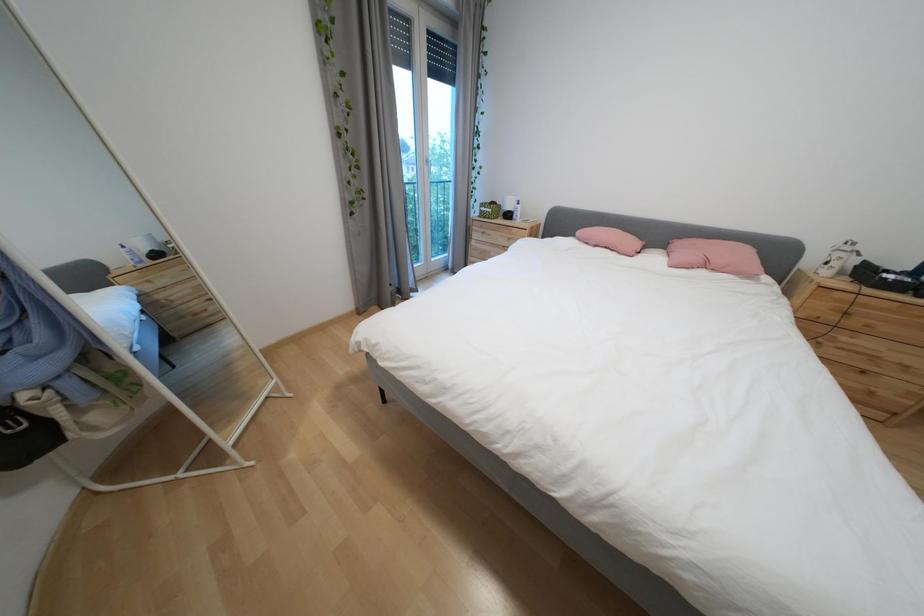
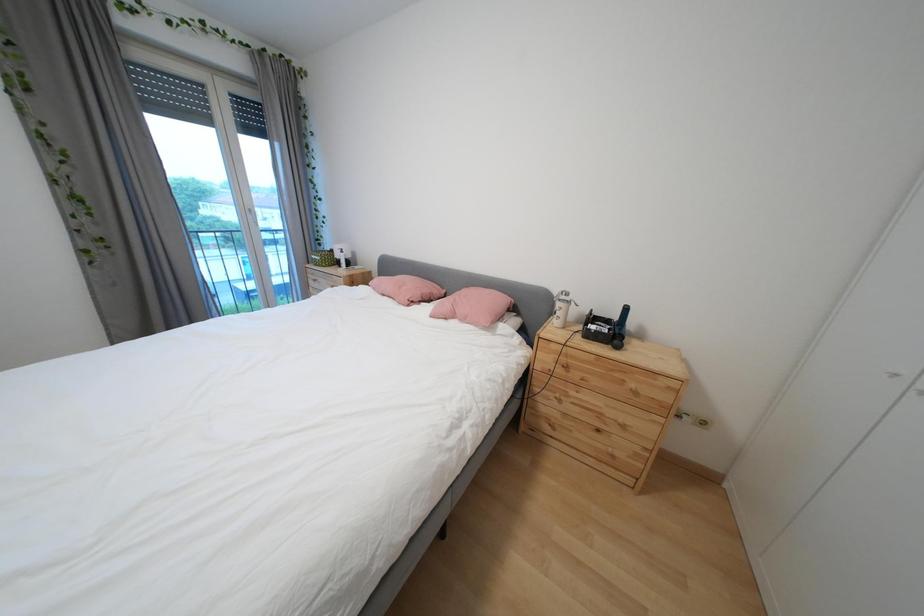
Question: The images are taken continuously from a first-person perspective. In which direction are you moving?

Choices:
 (A) Left
 (B) Right
 (C) Forward
 (D) Backward

Answer: (B)